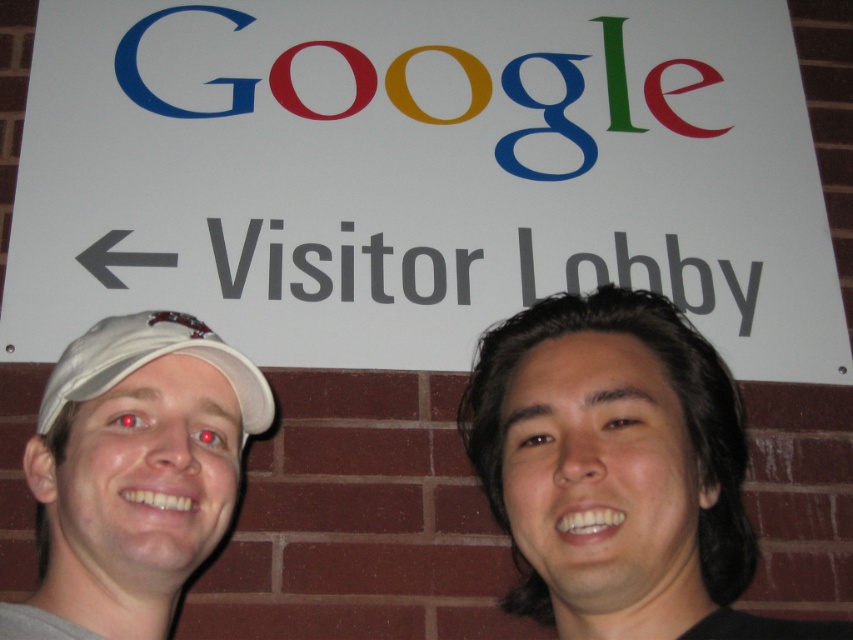
You are standing in the Google Visitor Lobby and want to find the entrance. The sign with the arrow points to the left. There is a point marked at coordinates (419, 176) on the white paper sign at upper center. If you face the sign and walk towards the point marked on the sign, will you be walking towards the entrance?

The point marked at coordinates (419, 176) is on the white paper sign at upper center. Since the sign has an arrow pointing to the left indicating the entrance direction, walking towards the point on the sign would mean facing the sign and moving towards its upper center area. However, the arrow itself points left, so following the arrow would lead to the entrance rather than walking directly towards the marked point. Therefore, walking towards the point might not align with the entrance direction unless

You are a photographer trying to capture the two people in the image. You notice that the white matte cap at left and the white fabric baseball cap at left are overlapping in the photo. Which cap should you adjust to ensure both are visible, and why?

You should adjust the white fabric baseball cap at left because the white matte cap at left is taller and might be covering part of it. By moving the shorter white fabric baseball cap at left slightly forward or backward, you can prevent overlap and ensure both caps are visible.